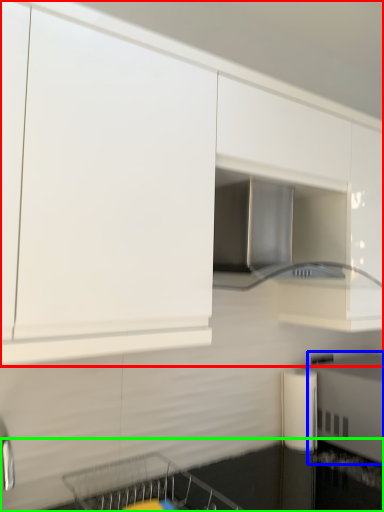
Question: Which is farther away from cabinetry (highlighted by a red box)? appliance (highlighted by a blue box) or countertop (highlighted by a green box)?

Choices:
 (A) appliance
 (B) countertop

Answer: (B)